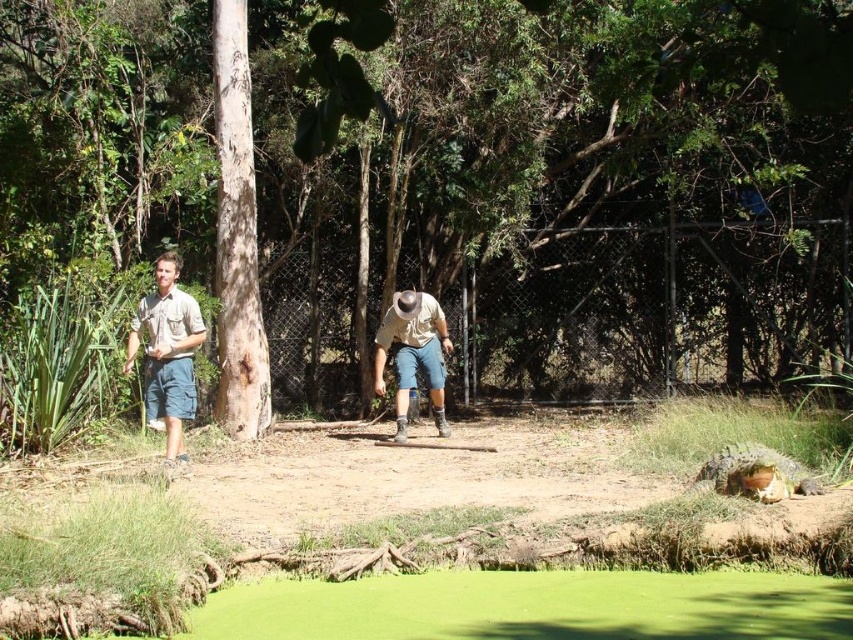
You are a photographer trying to capture both the point at coordinates point [425,384] and point [732,481] in your shot. Which point should you focus on first to ensure both are in focus?

You should focus on point [425,384] first because it is closer to the camera than point [732,481]. By focusing on the closer point, the farther point will also be in focus due to the depth of field.